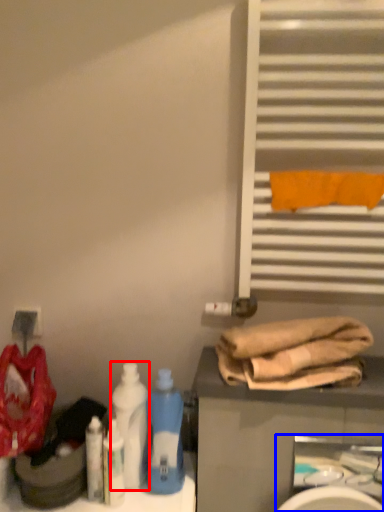
Question: Among these objects, which one is nearest to the camera, bottle (highlighted by a red box) or sink (highlighted by a blue box)?

Choices:
 (A) bottle
 (B) sink

Answer: (B)